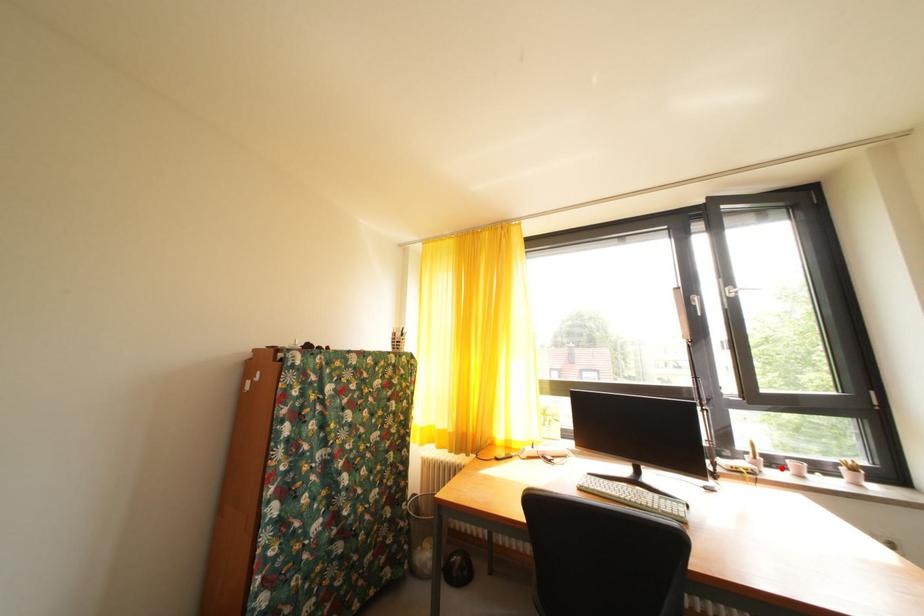
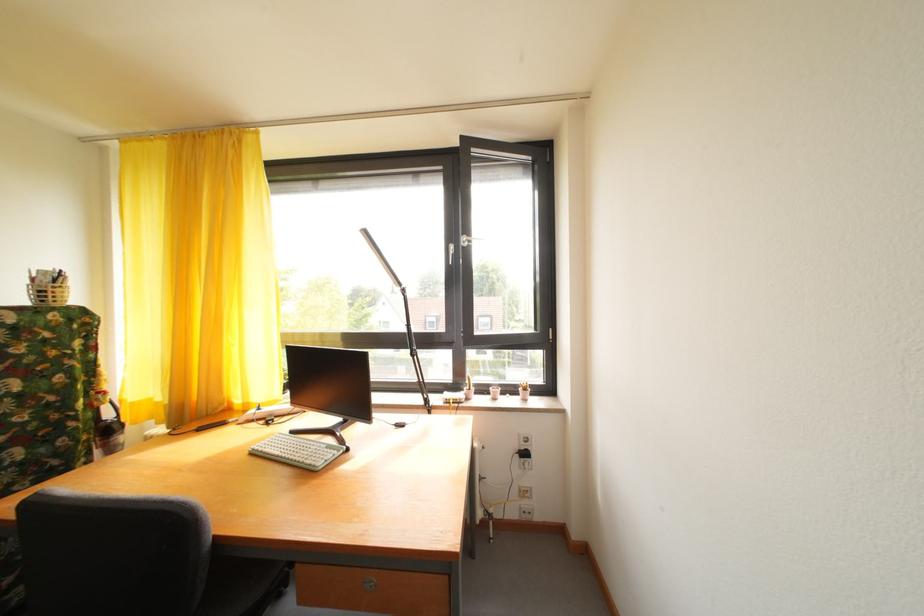
Question: I am providing you with two images of the same scene from different viewpoints. Image1 has a red point marked. In image2, the corresponding 3D location appears at what relative position? Reply with the corresponding letter.

Choices:
 (A) Closer
 (B) Farther

Answer: (B)